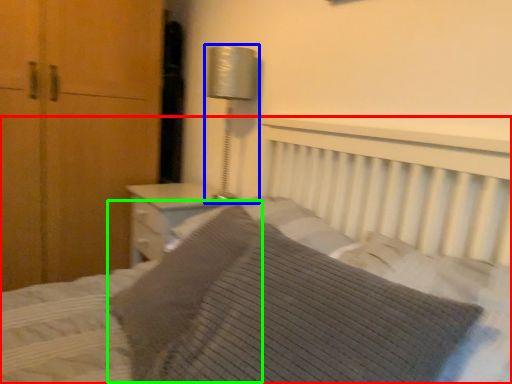
Question: Considering the real-world distances, which object is closest to bed (highlighted by a red box)? bedside lamp (highlighted by a blue box) or pillow (highlighted by a green box).

Choices:
 (A) bedside lamp
 (B) pillow

Answer: (B)